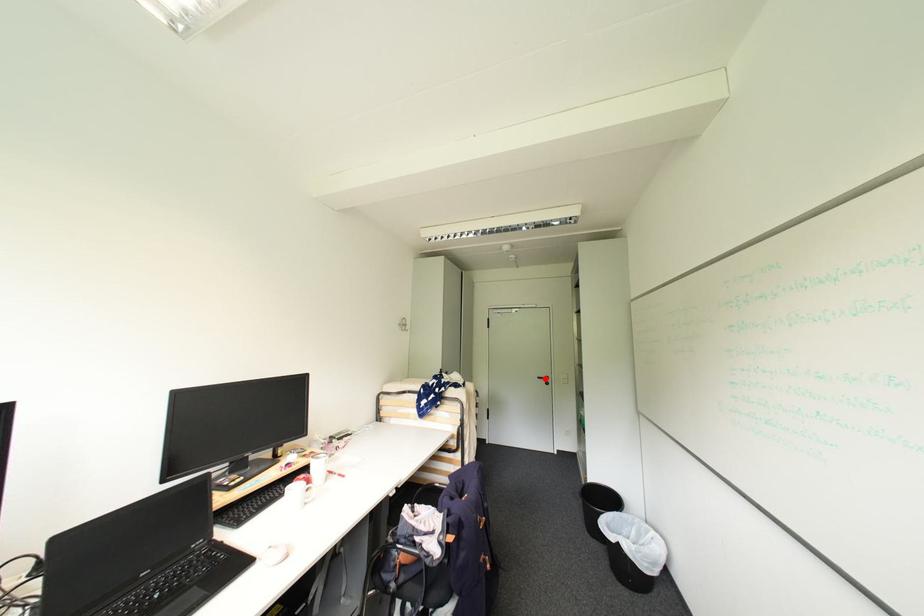
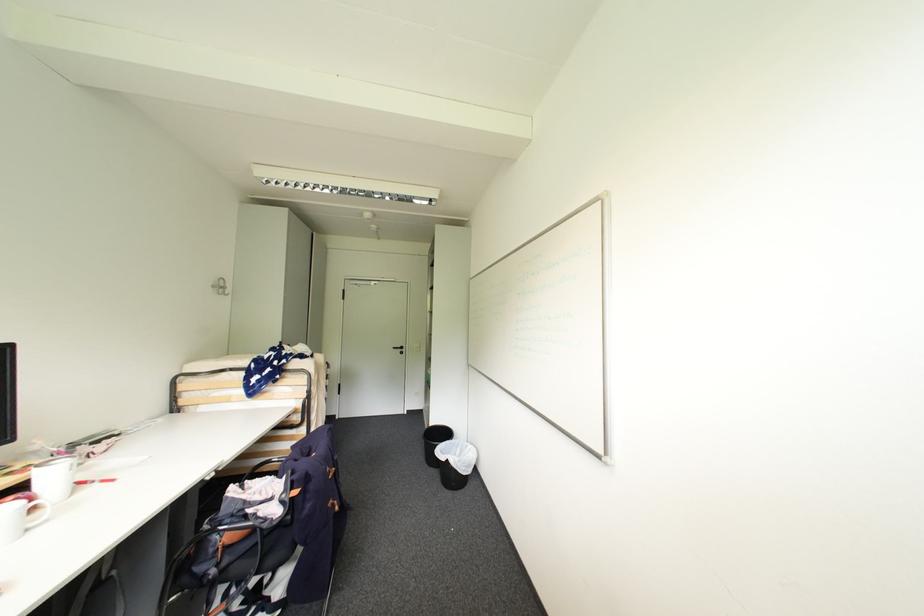
Question: I am providing you with two images of the same scene from different viewpoints. Given a red point in image1, look at the same physical point in image2. Is it:

Choices:
 (A) Closer to the viewpoint
 (B) Farther from the viewpoint

Answer: (B)